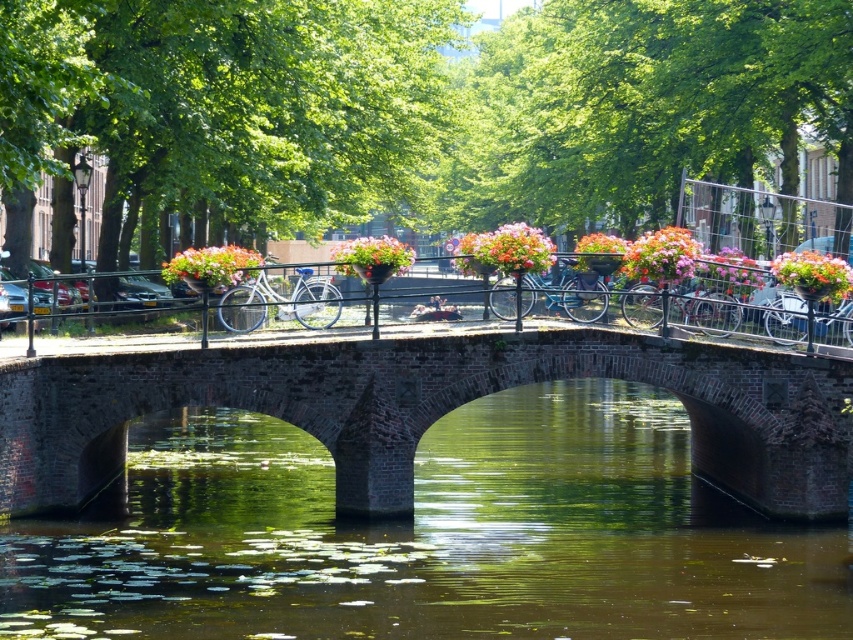
Who is more distant from viewer, (x=817, y=257) or (x=352, y=253)?

The point (x=817, y=257) is more distant.

Measure the distance between point (827, 256) and camera.

A distance of 39.54 meters exists between point (827, 256) and camera.

Who is more distant from viewer, (x=828, y=268) or (x=340, y=248)?

The point (x=340, y=248) is behind.

The height and width of the screenshot is (640, 853). What are the coordinates of `vivid pink petals at upper right` in the screenshot? It's located at (813, 275).

Does point (850, 349) come in front of point (648, 275)?

No, it is not.

Can you confirm if black metal railing at center is thinner than vibrant floral basket at center?

No.

Identify the location of black metal railing at center. The height and width of the screenshot is (640, 853). (102, 342).

Can you confirm if pink fabric flower at center is taller than matte white bicycle at center?

Yes.

The width and height of the screenshot is (853, 640). In order to click on pink fabric flower at center in this screenshot , I will do `click(505, 250)`.